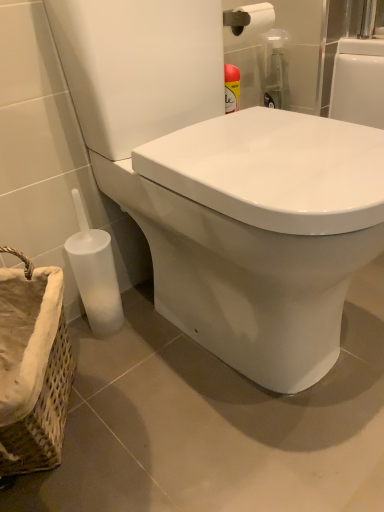
Question: Considering the positions of white matte toilet brush at lower left and woven fabric basket at lower left in the image, is white matte toilet brush at lower left wider or thinner than woven fabric basket at lower left?

Choices:
 (A) thin
 (B) wide

Answer: (A)

Question: Which is correct: white matte toilet brush at lower left is inside woven fabric basket at lower left, or outside of it?

Choices:
 (A) inside
 (B) outside

Answer: (B)

Question: Estimate the real-world distances between objects in this image. Which object is closer to the woven fabric basket at lower left?

Choices:
 (A) white glossy toilet at lower left
 (B) white matte toilet brush at lower left

Answer: (B)

Question: Which object is the closest to the white matte toilet brush at lower left?

Choices:
 (A) woven fabric basket at lower left
 (B) white glossy toilet at lower left

Answer: (A)